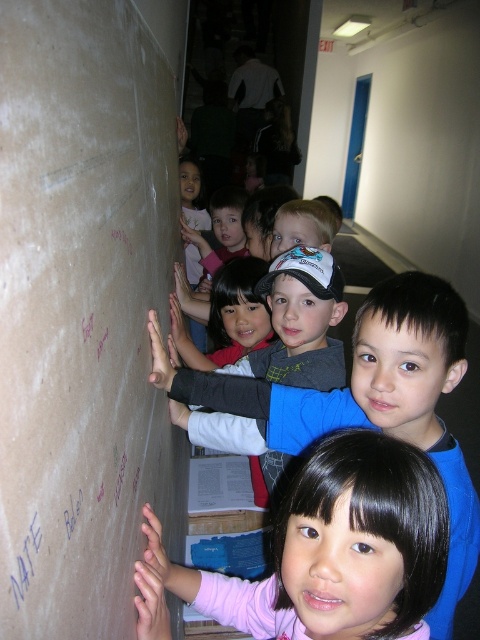
In the scene shown: You are a child standing in front of the unfinished wall and see two points marked on it. Which point, point (394, 500) or point (24, 596), is closer to you?

Point (394, 500) is further to the viewer than point (24, 596), so the point closer to you is point (24, 596).

You are a teacher who wants to hang a new poster on the matte cardboard bulletin board at left. The poster is 30 cm wide. Can you fit it horizontally on the bulletin board without overlapping the edge?

The matte cardboard bulletin board at left is located at point (84, 308), but without knowing its dimensions, it is impossible to determine if the poster will fit. Please provide more information about the bulletin board size.

You are a teacher organizing a classroom activity. You have a matte cardboard bulletin board at left and a pink fabric shirt at lower center in the scene. Which object is wider?

The pink fabric shirt at lower center is wider than the matte cardboard bulletin board at left.